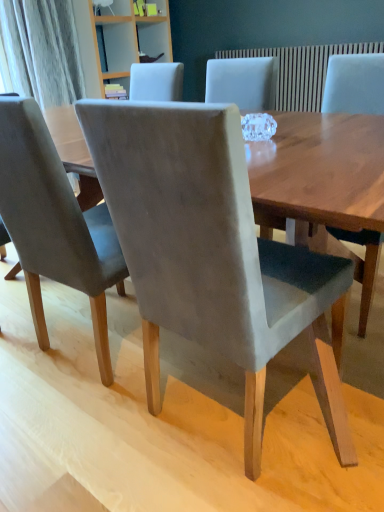
This screenshot has height=512, width=384. I want to click on free spot in front of suede gray chair at center, the 1th chair viewed from the left, so click(x=81, y=431).